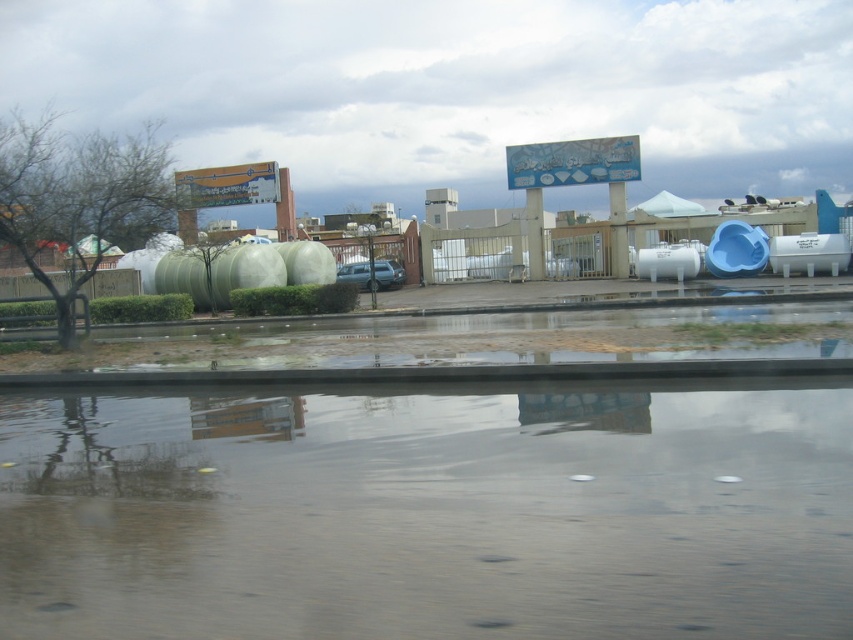
Identify the location of transparent water at lower center. This screenshot has width=853, height=640. (428, 513).

The width and height of the screenshot is (853, 640). What are the coordinates of `transparent water at lower center` in the screenshot? It's located at (428, 513).

This screenshot has width=853, height=640. In order to click on transparent water at lower center in this screenshot , I will do `click(428, 513)`.